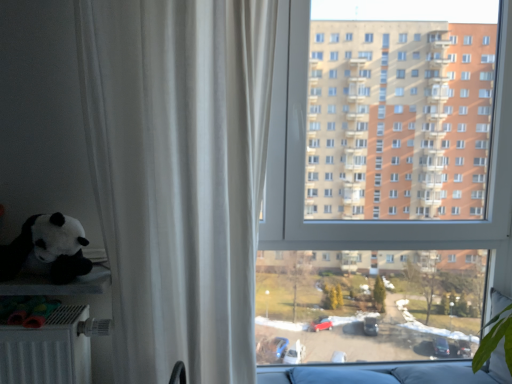
The height and width of the screenshot is (384, 512). Find the location of `transparent glass window at center`. transparent glass window at center is located at coordinates (377, 221).

Describe the element at coordinates (48, 248) in the screenshot. This screenshot has height=384, width=512. I see `matte black plush panda at left` at that location.

The width and height of the screenshot is (512, 384). I want to click on white sheer curtain at left, so click(179, 176).

Who is smaller, white sheer curtain at left or matte black plush panda at left?

matte black plush panda at left is smaller.

Can you confirm if white sheer curtain at left is thinner than matte black plush panda at left?

Incorrect, the width of white sheer curtain at left is not less than that of matte black plush panda at left.

Can matte black plush panda at left be found inside white sheer curtain at left?

Actually, matte black plush panda at left is outside white sheer curtain at left.

Visually, is white sheer curtain at left positioned to the left or to the right of matte black plush panda at left?

white sheer curtain at left is positioned on matte black plush panda at left's right side.

Is transparent glass window at center positioned beyond the bounds of matte black plush panda at left?

Yes, transparent glass window at center is outside of matte black plush panda at left.

Considering the sizes of objects transparent glass window at center and matte black plush panda at left in the image provided, who is taller, transparent glass window at center or matte black plush panda at left?

Standing taller between the two is transparent glass window at center.

Which is further, (503, 159) or (76, 256)?

The point (503, 159) is farther.

Does transparent glass window at center have a lesser width compared to matte black plush panda at left?

Indeed, transparent glass window at center has a lesser width compared to matte black plush panda at left.

Would you consider transparent glass window at center to be distant from white sheer curtain at left?

No, transparent glass window at center is in close proximity to white sheer curtain at left.

Considering the sizes of objects transparent glass window at center and white sheer curtain at left in the image provided, who is thinner, transparent glass window at center or white sheer curtain at left?

With smaller width is transparent glass window at center.

Does transparent glass window at center have a lesser height compared to white sheer curtain at left?

Incorrect, the height of transparent glass window at center does not fall short of that of white sheer curtain at left.

Is transparent glass window at center completely or partially outside of white sheer curtain at left?

Indeed, transparent glass window at center is completely outside white sheer curtain at left.

Is transparent glass window at center at the back of white sheer curtain at left?

No, white sheer curtain at left is not facing away from transparent glass window at center.

Is white sheer curtain at left wider than transparent glass window at center?

Yes, white sheer curtain at left is wider than transparent glass window at center.

Considering the sizes of objects white sheer curtain at left and transparent glass window at center in the image provided, who is bigger, white sheer curtain at left or transparent glass window at center?

white sheer curtain at left.

Looking at this image, from the image's perspective, is white sheer curtain at left beneath transparent glass window at center?

Correct, white sheer curtain at left appears lower than transparent glass window at center in the image.

Considering the sizes of matte black plush panda at left and white sheer curtain at left in the image, is matte black plush panda at left wider or thinner than white sheer curtain at left?

In the image, matte black plush panda at left appears to be more narrow than white sheer curtain at left.

From a real-world perspective, which object stands above the other?

white sheer curtain at left, from a real-world perspective.

Which is closer to the camera, (71, 234) or (181, 180)?

Point (181, 180)

Is matte black plush panda at left inside or outside of transparent glass window at center?

The correct answer is: outside.

Does matte black plush panda at left lie behind transparent glass window at center?

No, matte black plush panda at left is in front of transparent glass window at center.

Is point (67, 263) closer to viewer compared to point (302, 2)?

That is True.

The image size is (512, 384). Identify the location of curtain lying above the matte black plush panda at left (from the image's perspective). (179, 176).

Locate an element on the screen. Image resolution: width=512 pixels, height=384 pixels. window that appears on the right of matte black plush panda at left is located at coordinates (377, 221).

Which object lies nearer to the anchor point transparent glass window at center, white sheer curtain at left or matte black plush panda at left?

The object closer to transparent glass window at center is white sheer curtain at left.

Considering their positions, is transparent glass window at center positioned closer to white sheer curtain at left than matte black plush panda at left?

matte black plush panda at left.

Looking at the image, which one is located further to white sheer curtain at left, matte black plush panda at left or transparent glass window at center?

transparent glass window at center lies further to white sheer curtain at left than the other object.

Based on their spatial positions, is transparent glass window at center or white sheer curtain at left further from matte black plush panda at left?

transparent glass window at center is positioned further to the anchor matte black plush panda at left.

Looking at the image, which one is located further to matte black plush panda at left, white sheer curtain at left or transparent glass window at center?

transparent glass window at center lies further to matte black plush panda at left than the other object.

Estimate the real-world distances between objects in this image. Which object is further from transparent glass window at center, matte black plush panda at left or white sheer curtain at left?

The object further to transparent glass window at center is matte black plush panda at left.

Locate an element on the screen. curtain between matte black plush panda at left and transparent glass window at center is located at coordinates (179, 176).